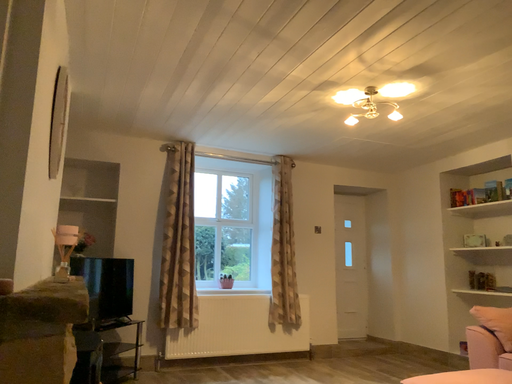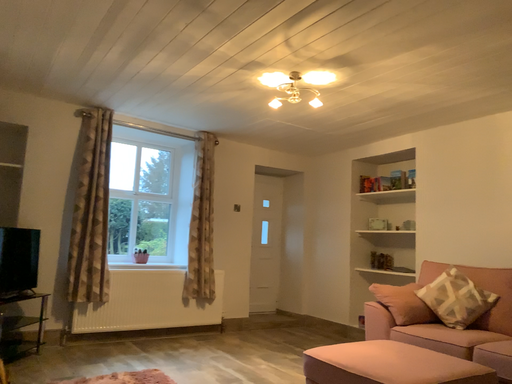
Question: Which way did the camera rotate in the video?

Choices:
 (A) rotated right
 (B) rotated left

Answer: (A)